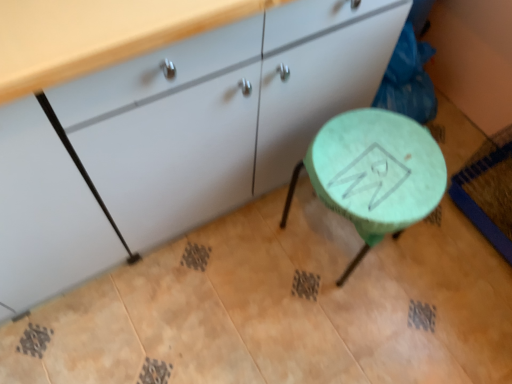
The width and height of the screenshot is (512, 384). What do you see at coordinates (374, 173) in the screenshot?
I see `green matte stool at center` at bounding box center [374, 173].

Find the location of a particular element. This screenshot has width=512, height=384. green matte stool at center is located at coordinates pos(374,173).

In order to face green matte stool at center, should I rotate leftwards or rightwards?

Turn right approximately 13.774 degrees to face it.

Measure the distance between point (133, 169) and camera.

Point (133, 169) is 91.80 centimeters from camera.

What do you see at coordinates (222, 111) in the screenshot? I see `matte white cabinet at center` at bounding box center [222, 111].

You are a GUI agent. You are given a task and a screenshot of the screen. Output one action in this format:
    pyautogui.click(x=<x>, y=<y>)
    Task: Click on the matte white cabinet at center
    
    Given the screenshot: What is the action you would take?
    pyautogui.click(x=222, y=111)

The image size is (512, 384). Find the location of `green matte stool at center`. green matte stool at center is located at coordinates (374, 173).

Considering the relative positions of matte white cabinet at center and green matte stool at center in the image provided, is matte white cabinet at center to the left or to the right of green matte stool at center?

matte white cabinet at center is to the left of green matte stool at center.

Is matte white cabinet at center positioned in front of green matte stool at center?

Yes, matte white cabinet at center is in front of green matte stool at center.

Is point (189, 39) positioned behind point (420, 170)?

No, (189, 39) is in front of (420, 170).

From the image's perspective, would you say matte white cabinet at center is positioned over green matte stool at center?

Yes, from the image's perspective, matte white cabinet at center is above green matte stool at center.

From a real-world perspective, is matte white cabinet at center above or below green matte stool at center?

Clearly, from a real-world perspective, matte white cabinet at center is above green matte stool at center.

Considering the relative sizes of matte white cabinet at center and green matte stool at center in the image provided, is matte white cabinet at center thinner than green matte stool at center?

No, matte white cabinet at center is not thinner than green matte stool at center.

Is matte white cabinet at center shorter than green matte stool at center?

In fact, matte white cabinet at center may be taller than green matte stool at center.

Considering the sizes of objects matte white cabinet at center and green matte stool at center in the image provided, who is smaller, matte white cabinet at center or green matte stool at center?

green matte stool at center.

Is green matte stool at center located within matte white cabinet at center?

That's incorrect, green matte stool at center is not inside matte white cabinet at center.

Are matte white cabinet at center and green matte stool at center located far from each other?

matte white cabinet at center is actually quite close to green matte stool at center.

Is matte white cabinet at center positioned with its back to green matte stool at center?

matte white cabinet at center does not have its back to green matte stool at center.

How distant is matte white cabinet at center from green matte stool at center?

matte white cabinet at center is 12.04 inches from green matte stool at center.

This screenshot has height=384, width=512. I want to click on table directly beneath the matte white cabinet at center (from a real-world perspective), so click(374, 173).

Does green matte stool at center appear on the left side of matte white cabinet at center?

Incorrect, green matte stool at center is not on the left side of matte white cabinet at center.

Is green matte stool at center positioned in front of matte white cabinet at center?

No, it is not.

Is point (392, 207) closer to camera compared to point (255, 124)?

Yes, point (392, 207) is closer to viewer.

From the picture: From the image's perspective, is green matte stool at center beneath matte white cabinet at center?

Yes, from the image's perspective, green matte stool at center is below matte white cabinet at center.

From a real-world perspective, relative to matte white cabinet at center, is green matte stool at center vertically above or below?

green matte stool at center is below matte white cabinet at center.

Is green matte stool at center thinner than matte white cabinet at center?

Correct, the width of green matte stool at center is less than that of matte white cabinet at center.

Between green matte stool at center and matte white cabinet at center, which one has more height?

With more height is matte white cabinet at center.

Which of these two, green matte stool at center or matte white cabinet at center, is bigger?

Bigger between the two is matte white cabinet at center.

Is green matte stool at center inside the boundaries of matte white cabinet at center, or outside?

green matte stool at center is not inside matte white cabinet at center, it's outside.

Are green matte stool at center and matte white cabinet at center beside each other?

They are not placed beside each other.

Is green matte stool at center facing towards matte white cabinet at center?

No, green matte stool at center does not turn towards matte white cabinet at center.

How many degrees apart are the facing directions of green matte stool at center and matte white cabinet at center?

They differ by 2.48e-05 degrees in their facing directions.

How far apart are green matte stool at center and matte white cabinet at center?

The distance of green matte stool at center from matte white cabinet at center is 30.57 centimeters.

This screenshot has height=384, width=512. Identify the location of cabinetry above the green matte stool at center (from the image's perspective). (222, 111).

Image resolution: width=512 pixels, height=384 pixels. Identify the location of table located behind the matte white cabinet at center. (374, 173).

Identify the location of cabinetry positioned vertically above the green matte stool at center (from a real-world perspective). (222, 111).